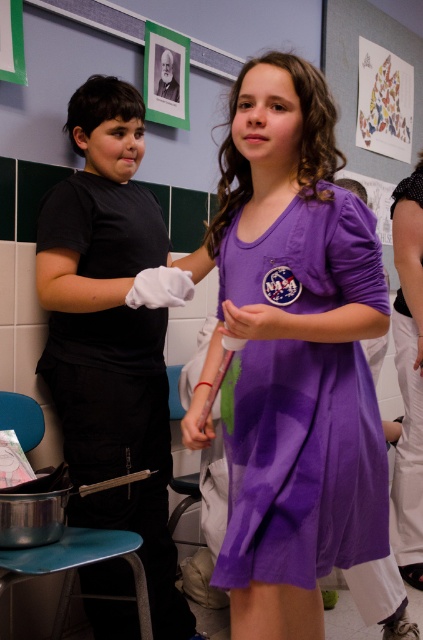
Question: Does black matte shirt at left have a smaller size compared to metallic blue stool at lower left?

Choices:
 (A) no
 (B) yes

Answer: (A)

Question: Which point is closer to the camera taking this photo?

Choices:
 (A) (252, 324)
 (B) (73, 99)
 (C) (181, 426)

Answer: (A)

Question: Which object is positioned farthest from the purple fabric hand at center?

Choices:
 (A) purple cotton dress at center
 (B) metallic blue stool at lower left
 (C) matte purple dress at center
 (D) black matte shirt at left

Answer: (B)

Question: Is metallic blue stool at lower left positioned behind purple fabric hand at center?

Choices:
 (A) yes
 (B) no

Answer: (A)

Question: Which is farther from the purple fabric hand at center?

Choices:
 (A) matte purple dress at center
 (B) purple cotton dress at center
 (C) black matte shirt at left
 (D) metallic blue stool at lower left

Answer: (D)

Question: Is purple fabric hand at center in front of matte purple dress at center?

Choices:
 (A) yes
 (B) no

Answer: (A)